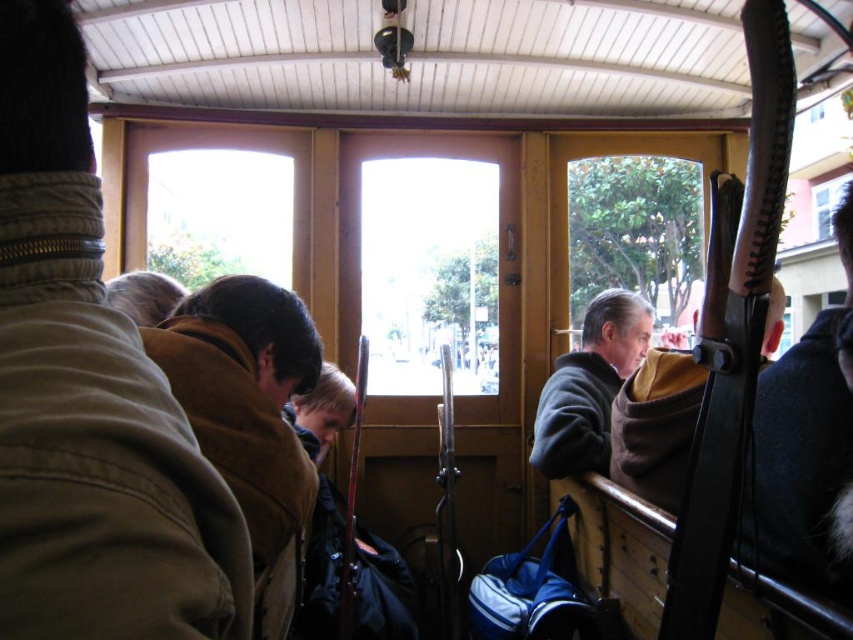
Does point (94, 209) lie in front of point (808, 435)?

That is True.

Which of these two, brown leather jacket at upper left or black fur coat at right, stands shorter?

brown leather jacket at upper left

At what (x,y) coordinates should I click in order to perform the action: click on brown leather jacket at upper left. Please return your answer as a coordinate pair (x, y). The image size is (853, 640). Looking at the image, I should click on (x=90, y=396).

Is brown leather jacket at upper left to the right of brown suede jacket at left from the viewer's perspective?

Indeed, brown leather jacket at upper left is positioned on the right side of brown suede jacket at left.

The width and height of the screenshot is (853, 640). I want to click on brown leather jacket at upper left, so click(x=90, y=396).

Is point (109, 310) more distant than point (253, 538)?

No.

Image resolution: width=853 pixels, height=640 pixels. I want to click on brown leather jacket at upper left, so click(x=90, y=396).

Who is higher up, brown suede jacket at left or dark gray sweater at right?

brown suede jacket at left

Is point (259, 435) closer to camera compared to point (579, 364)?

Yes.

Where is `brown suede jacket at left`? brown suede jacket at left is located at coordinates (245, 396).

Locate an element on the screen. This screenshot has width=853, height=640. brown suede jacket at left is located at coordinates (245, 396).